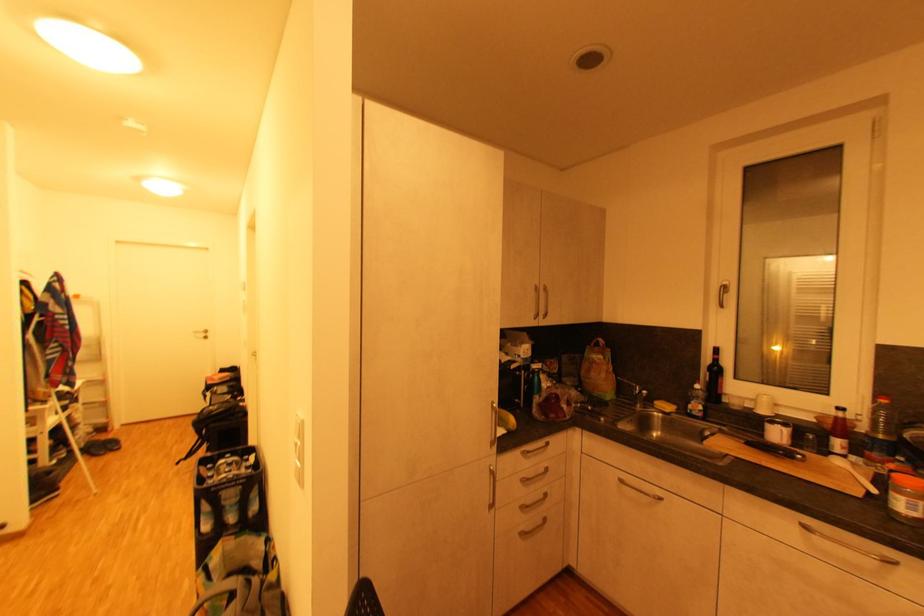
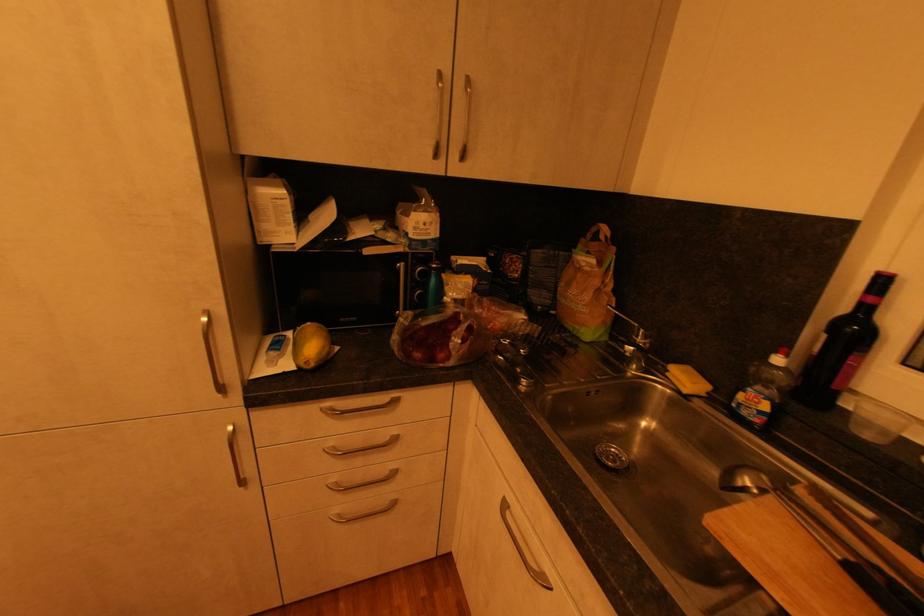
The images are taken continuously from a first-person perspective. In which direction are you moving?

The cameraman walked toward right, forward.